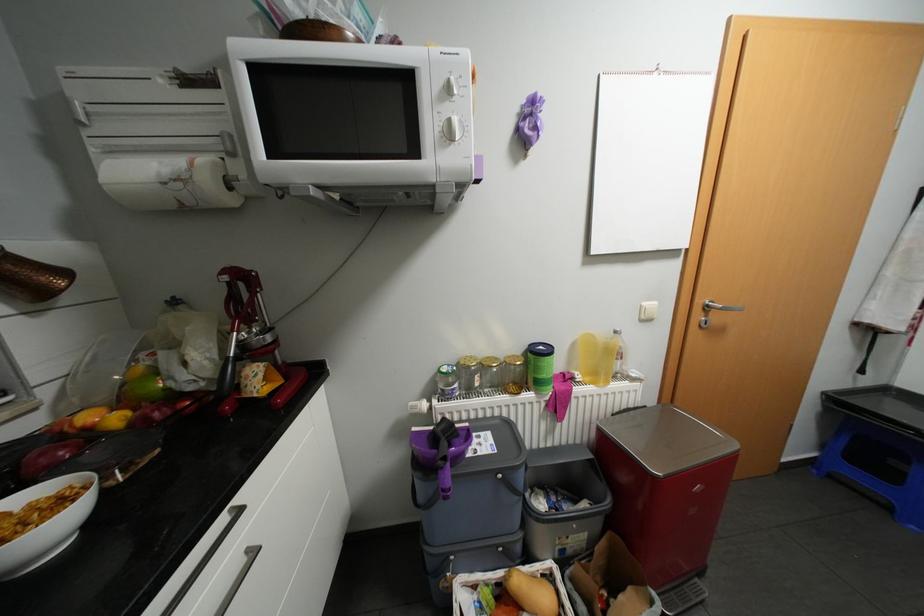
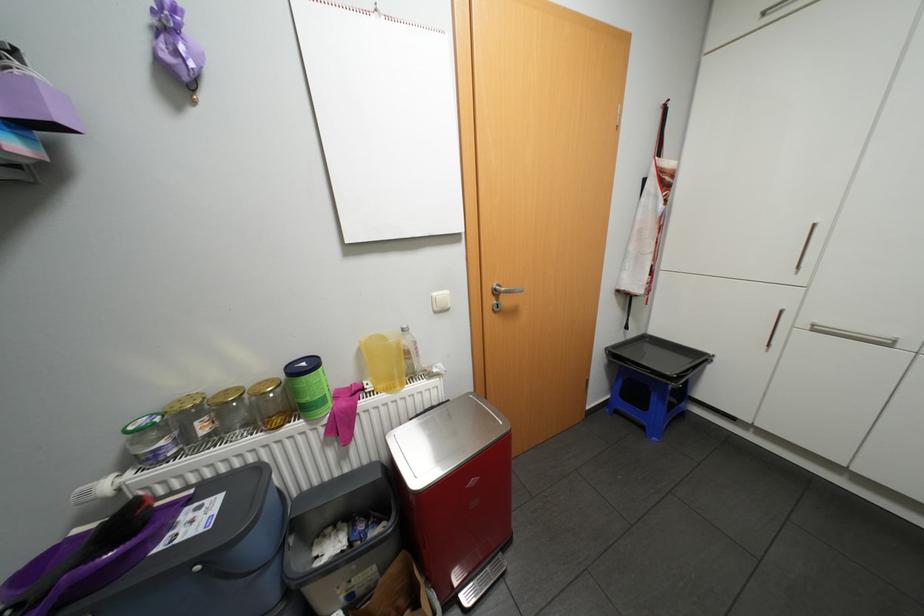
Question: Which direction would the cameraman need to move to produce the second image? Reply with the corresponding letter.

Choices:
 (A) Left
 (B) Right
 (C) Forward
 (D) Backward

Answer: (B)